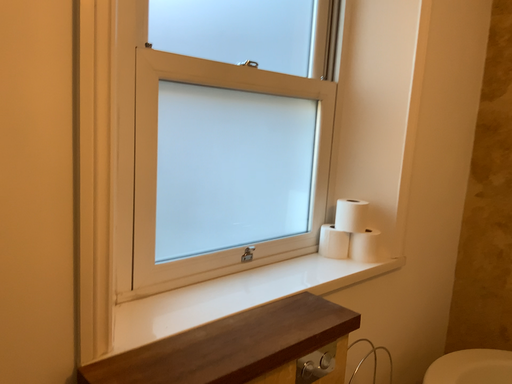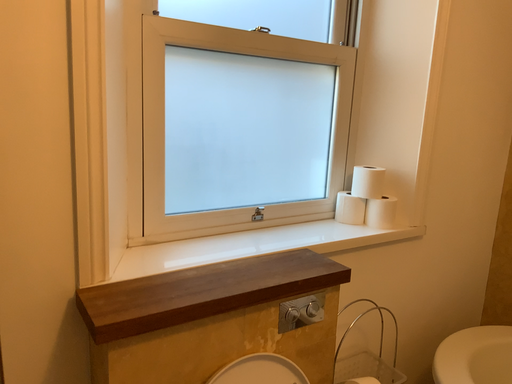
Question: How did the camera likely rotate when shooting the video?

Choices:
 (A) rotated left
 (B) rotated right

Answer: (A)